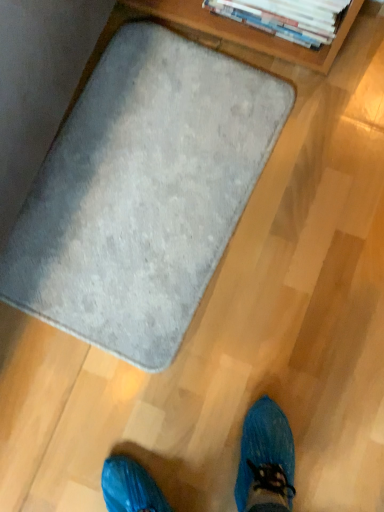
In order to click on white paperbacks at upper right in this screenshot , I will do `click(283, 18)`.

This screenshot has width=384, height=512. What do you see at coordinates (283, 18) in the screenshot? I see `white paperbacks at upper right` at bounding box center [283, 18].

What is the approximate height of white paperbacks at upper right?

It is 7.49 inches.

Where is `white paperbacks at upper right`? This screenshot has height=512, width=384. white paperbacks at upper right is located at coordinates 283,18.